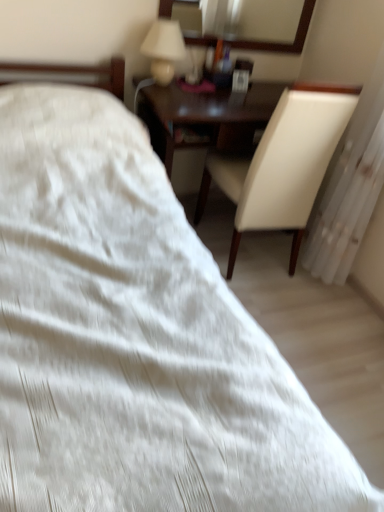
Question: From the image's perspective, is white fabric radiator at right beneath white leather chair at right?

Choices:
 (A) yes
 (B) no

Answer: (A)

Question: Can we say white fabric radiator at right lies outside white leather chair at right?

Choices:
 (A) no
 (B) yes

Answer: (B)

Question: Is white fabric radiator at right smaller than white leather chair at right?

Choices:
 (A) yes
 (B) no

Answer: (A)

Question: Considering the relative sizes of white fabric radiator at right and white leather chair at right in the image provided, is white fabric radiator at right thinner than white leather chair at right?

Choices:
 (A) yes
 (B) no

Answer: (A)

Question: From a real-world perspective, is white fabric radiator at right positioned over white leather chair at right based on gravity?

Choices:
 (A) no
 (B) yes

Answer: (B)

Question: Is white fabric radiator at right wider or thinner than wooden-framed mirror at upper center?

Choices:
 (A) thin
 (B) wide

Answer: (B)

Question: From their relative heights in the image, would you say white fabric radiator at right is taller or shorter than wooden-framed mirror at upper center?

Choices:
 (A) short
 (B) tall

Answer: (B)

Question: Based on their positions, is white fabric radiator at right located to the left or right of wooden-framed mirror at upper center?

Choices:
 (A) right
 (B) left

Answer: (A)

Question: Considering the positions of white fabric radiator at right and wooden-framed mirror at upper center in the image, is white fabric radiator at right bigger or smaller than wooden-framed mirror at upper center?

Choices:
 (A) small
 (B) big

Answer: (B)

Question: Would you say matte white lampshade at upper center is to the left or to the right of white fabric radiator at right in the picture?

Choices:
 (A) left
 (B) right

Answer: (A)

Question: From the image's perspective, relative to white fabric radiator at right, is matte white lampshade at upper center above or below?

Choices:
 (A) below
 (B) above

Answer: (B)

Question: Is matte white lampshade at upper center bigger or smaller than white fabric radiator at right?

Choices:
 (A) big
 (B) small

Answer: (B)

Question: Is matte white lampshade at upper center wider or thinner than white fabric radiator at right?

Choices:
 (A) wide
 (B) thin

Answer: (B)

Question: Considering the positions of matte white lampshade at upper center and white leather chair at right in the image, is matte white lampshade at upper center taller or shorter than white leather chair at right?

Choices:
 (A) tall
 (B) short

Answer: (B)

Question: Is point (172, 76) positioned closer to the camera than point (284, 163)?

Choices:
 (A) closer
 (B) farther

Answer: (B)